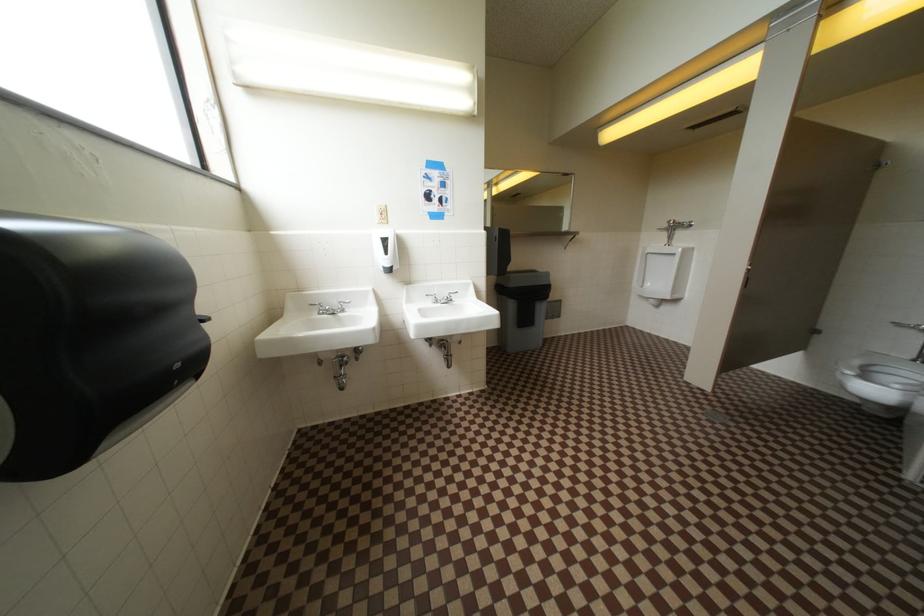
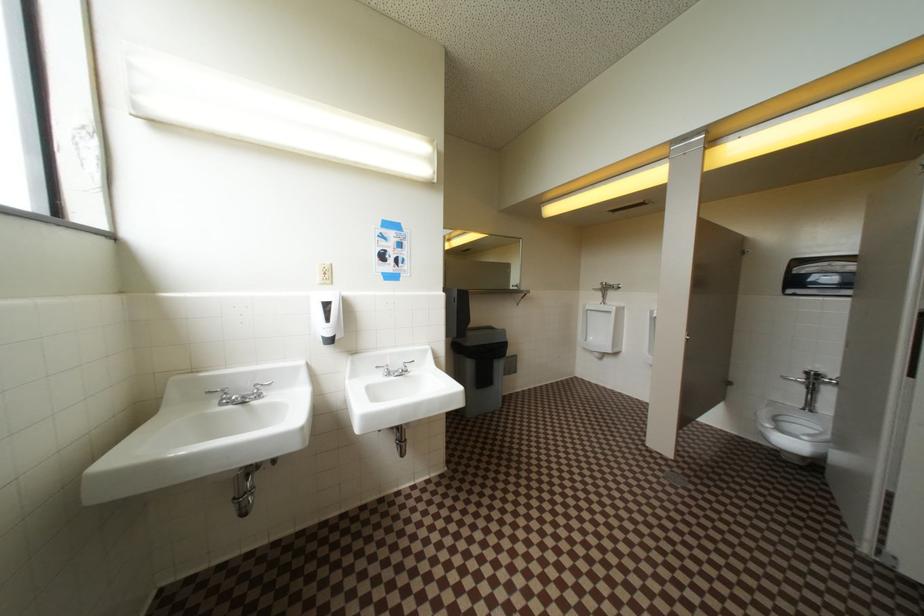
Question: In a continuous first-person perspective shot, in which direction is the camera moving?

Choices:
 (A) Left
 (B) Right
 (C) Forward
 (D) Backward

Answer: (C)